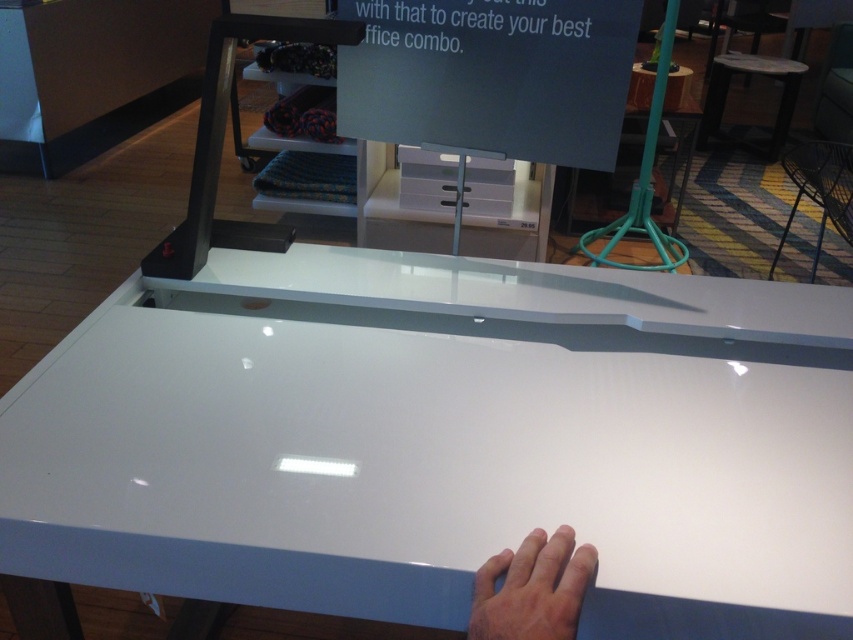
You are a customer looking to purchase a desk combo. You see the skinny white hand at lower center resting on the desk edge. Where exactly is the hand positioned relative to the desk?

The skinny white hand at lower center is positioned at point 0.920 on the x axis and 0.625 on the y axis relative to the desk.

You are an interior designer planning to place a tall plant between the metallic silver stool at lower right and the white glossy stool at upper right. Based on the height of the stools, which stool would the top of the plant be taller than?

The metallic silver stool at lower right has a lesser height compared to the white glossy stool at upper right. Therefore, the top of the plant would be taller than the metallic silver stool at lower right if placed between them.